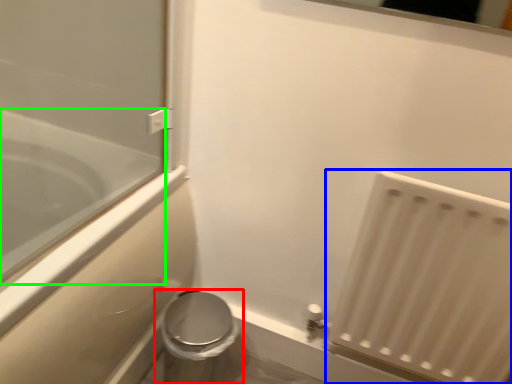
Question: Which object is positioned closest to toilet (highlighted by a red box)? Select from radiator (highlighted by a blue box) and bathtub (highlighted by a green box).

Choices:
 (A) radiator
 (B) bathtub

Answer: (B)